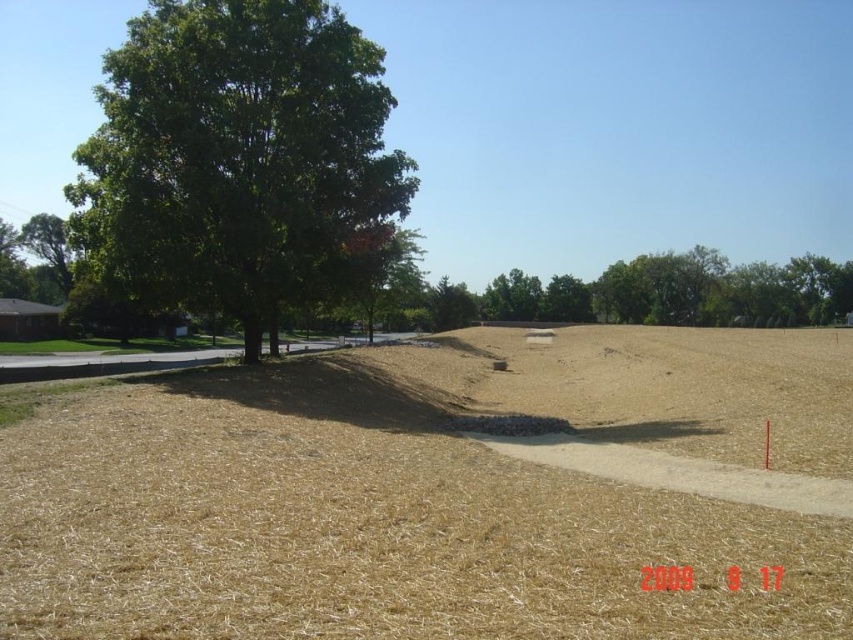
Can you confirm if brown dry grass at center is positioned to the right of green leafy tree at center?

No, brown dry grass at center is not to the right of green leafy tree at center.

Can you confirm if brown dry grass at center is thinner than green leafy tree at center?

Correct, brown dry grass at center's width is less than green leafy tree at center's.

Does point (395, 589) come farther from viewer compared to point (650, 321)?

No, it is in front of (650, 321).

Find the location of a particular element. brown dry grass at center is located at coordinates coord(426,497).

Who is more forward, (148, 58) or (679, 273)?

Point (148, 58) is more forward.

Who is lower down, green leafy tree at left or green leafy tree at center?

green leafy tree at left is lower down.

Is point (229, 100) positioned before point (659, 269)?

Yes, it is in front of point (659, 269).

The image size is (853, 640). Find the location of `green leafy tree at left`. green leafy tree at left is located at coordinates (241, 157).

Which of these two, brown dry grass at center or green leafy tree at left, stands shorter?

Standing shorter between the two is brown dry grass at center.

Does brown dry grass at center have a smaller size compared to green leafy tree at left?

Actually, brown dry grass at center might be larger than green leafy tree at left.

Between point (801, 433) and point (178, 112), which one is positioned in front?

Point (801, 433)

Identify the location of brown dry grass at center. (426, 497).